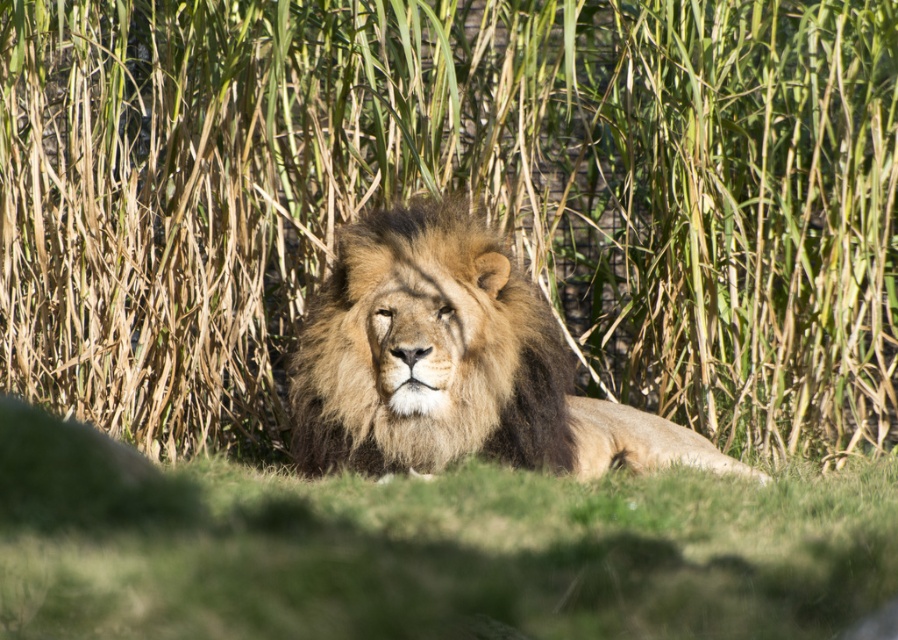
Question: Among these objects, which one is farthest from the camera?

Choices:
 (A) golden fur lion at center
 (B) green soft grass at center

Answer: (A)

Question: Is green soft grass at center bigger than golden fur lion at center?

Choices:
 (A) yes
 (B) no

Answer: (A)

Question: Which of the following is the closest to the observer?

Choices:
 (A) golden fur lion at center
 (B) green soft grass at center

Answer: (B)

Question: From the image, what is the correct spatial relationship of green soft grass at center in relation to golden fur lion at center?

Choices:
 (A) below
 (B) above

Answer: (A)

Question: Which point is farther to the camera?

Choices:
 (A) (321, 636)
 (B) (485, 401)

Answer: (B)

Question: Does green soft grass at center appear on the right side of golden fur lion at center?

Choices:
 (A) yes
 (B) no

Answer: (B)